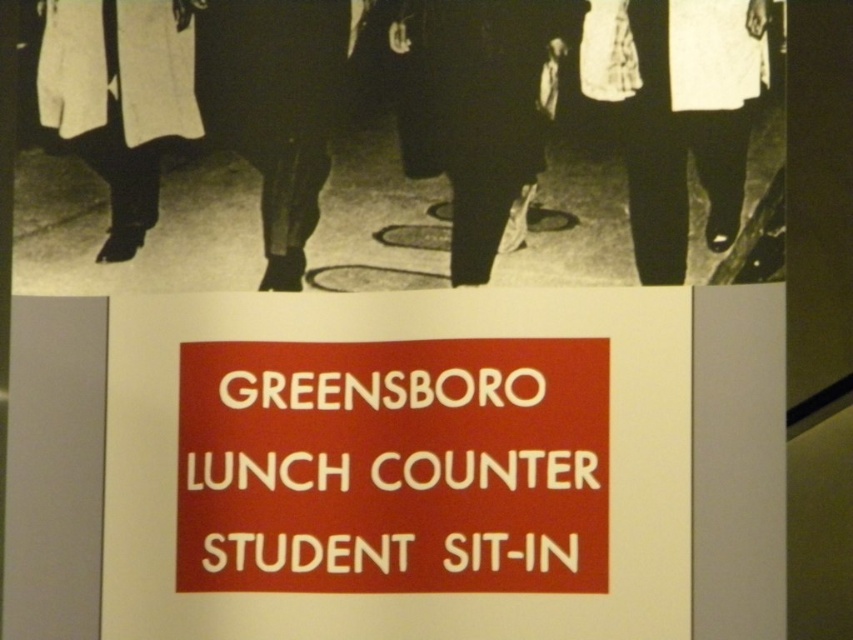
You are an observer standing in front of the image. You notice two pairs of pants at the center of the scene. Which pair has a wider leg? The pants in question are the dark fabric pants at center and the matte black pants at center.

The dark fabric pants at center has a wider leg than the matte black pants at center according to the description provided.